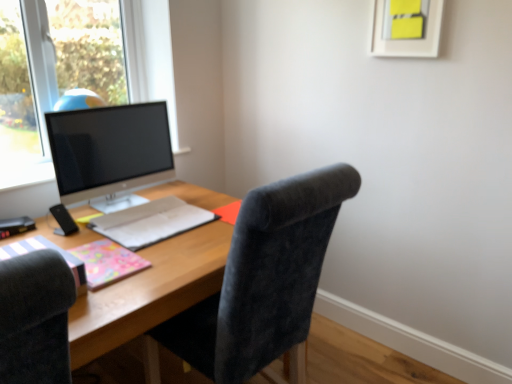
Where is `vacant area that is situated to the right of pink glossy notebook at lower left, marked as the second notebook in a front-to-back arrangement`? Image resolution: width=512 pixels, height=384 pixels. vacant area that is situated to the right of pink glossy notebook at lower left, marked as the second notebook in a front-to-back arrangement is located at coordinates (170, 259).